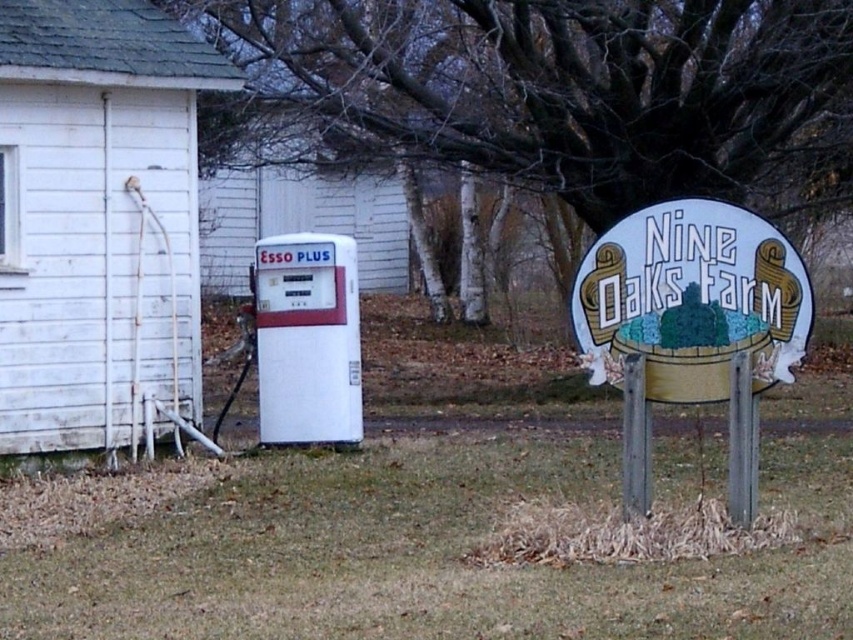
Does white matte gas pump at center have a greater height compared to white plastic gas pump at center?

Correct, white matte gas pump at center is much taller as white plastic gas pump at center.

Who is more distant from viewer, (102, 593) or (236, 294)?

Positioned behind is point (236, 294).

Image resolution: width=853 pixels, height=640 pixels. What are the coordinates of `white matte gas pump at center` in the screenshot? It's located at (392, 532).

Between white matte gas pump at center and white wood hut at left, which one is positioned lower?

white matte gas pump at center is below.

Is point (425, 468) positioned before point (193, 378)?

Yes.

Is point (532, 577) positioned after point (112, 161)?

No, (532, 577) is closer to viewer.

What are the coordinates of `white matte gas pump at center` in the screenshot? It's located at (392, 532).

Which is more to the right, white wood hut at left or white wooden sign at center right?

white wooden sign at center right

Does white wood hut at left appear on the left side of white wooden sign at center right?

Indeed, white wood hut at left is positioned on the left side of white wooden sign at center right.

Where is `white wood hut at left`? This screenshot has height=640, width=853. white wood hut at left is located at coordinates (97, 220).

In order to click on white wood hut at left in this screenshot , I will do `click(97, 220)`.